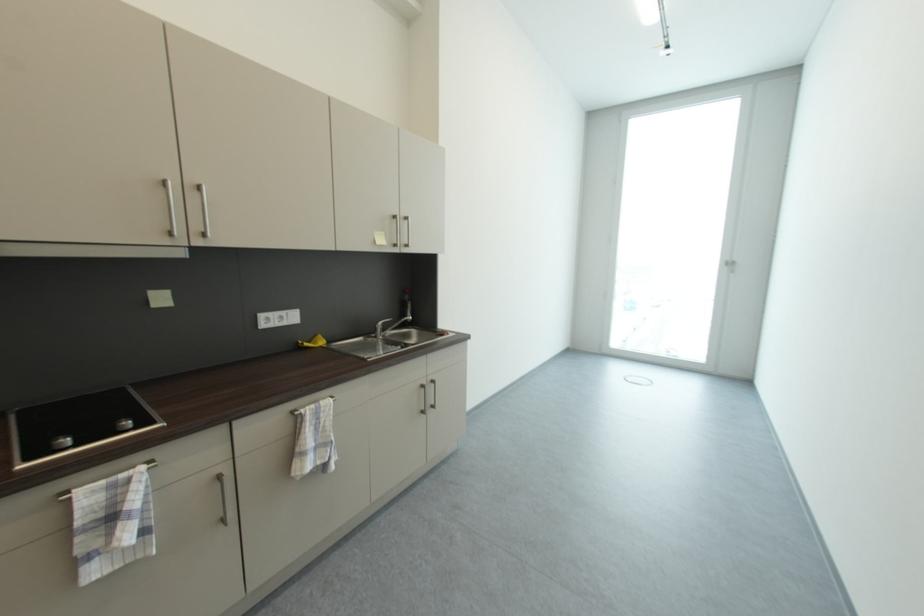
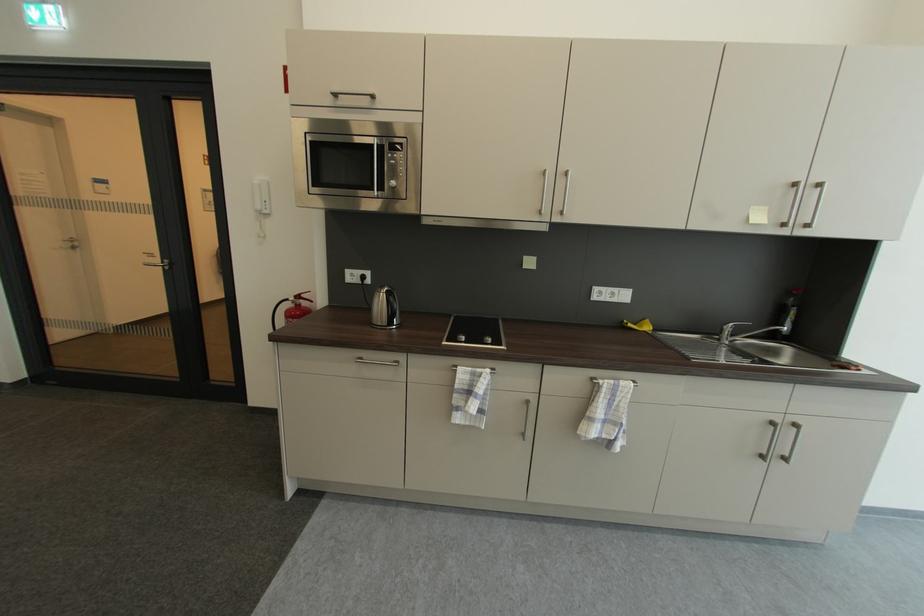
Question: Based on the continuous images, in which direction is the camera rotating? Reply with the corresponding letter.

Choices:
 (A) Left
 (B) Right
 (C) Up
 (D) Down

Answer: (A)